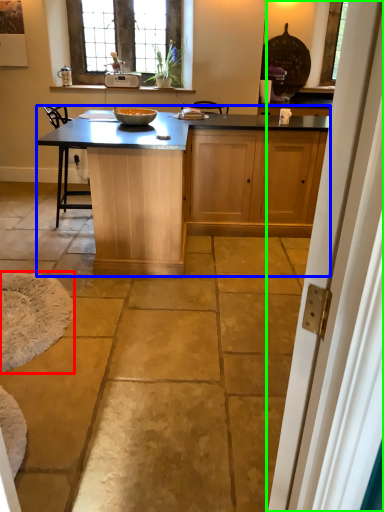
Question: Which object is the farthest from wide (highlighted by a red box)? Choose among these: kitchen & dining room table (highlighted by a blue box) or screen door (highlighted by a green box).

Choices:
 (A) kitchen & dining room table
 (B) screen door

Answer: (B)